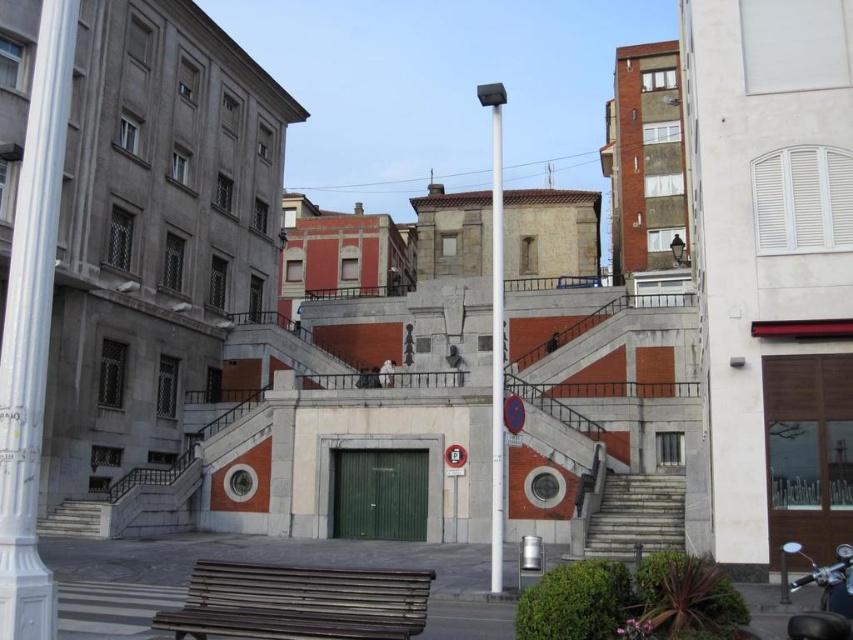
Who is positioned more to the right, wooden bench at lower center or smooth concrete stairs at lower left?

Positioned to the right is wooden bench at lower center.

Does wooden bench at lower center appear on the right side of smooth concrete stairs at lower left?

Yes, wooden bench at lower center is to the right of smooth concrete stairs at lower left.

What do you see at coordinates (299, 602) in the screenshot?
I see `wooden bench at lower center` at bounding box center [299, 602].

At what (x,y) coordinates should I click in order to perform the action: click on wooden bench at lower center. Please return your answer as a coordinate pair (x, y). Looking at the image, I should click on click(x=299, y=602).

Does white polished column at left appear under polished metal pole at center?

Yes.

Can you confirm if white polished column at left is positioned to the left of polished metal pole at center?

Correct, you'll find white polished column at left to the left of polished metal pole at center.

Where is `white polished column at left`? This screenshot has height=640, width=853. white polished column at left is located at coordinates (32, 330).

Find the location of a particular element. The height and width of the screenshot is (640, 853). white polished column at left is located at coordinates (32, 330).

Can you confirm if wooden bench at lower center is shorter than gray stone stairs at right?

In fact, wooden bench at lower center may be taller than gray stone stairs at right.

Identify the location of wooden bench at lower center. (299, 602).

Find the location of a particular element. wooden bench at lower center is located at coordinates (299, 602).